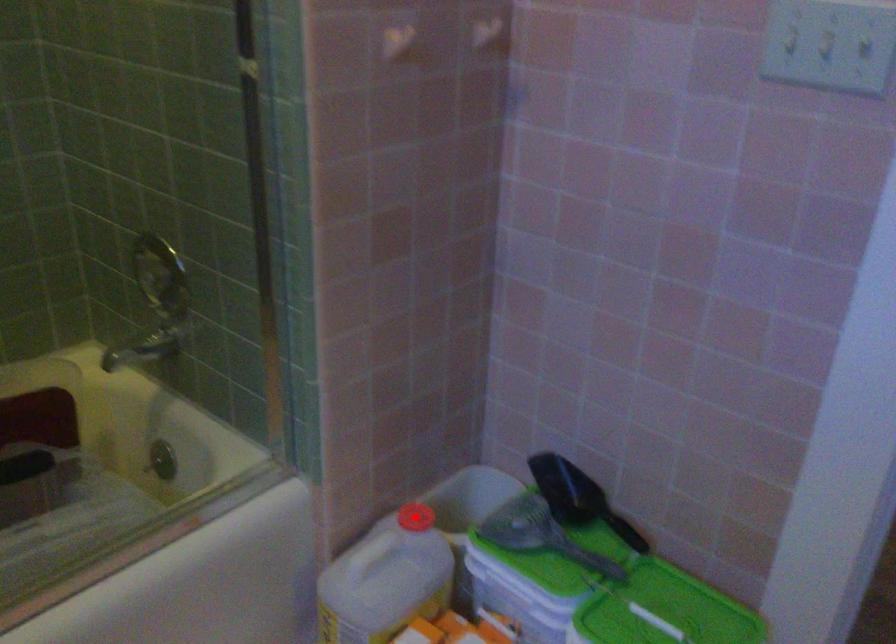
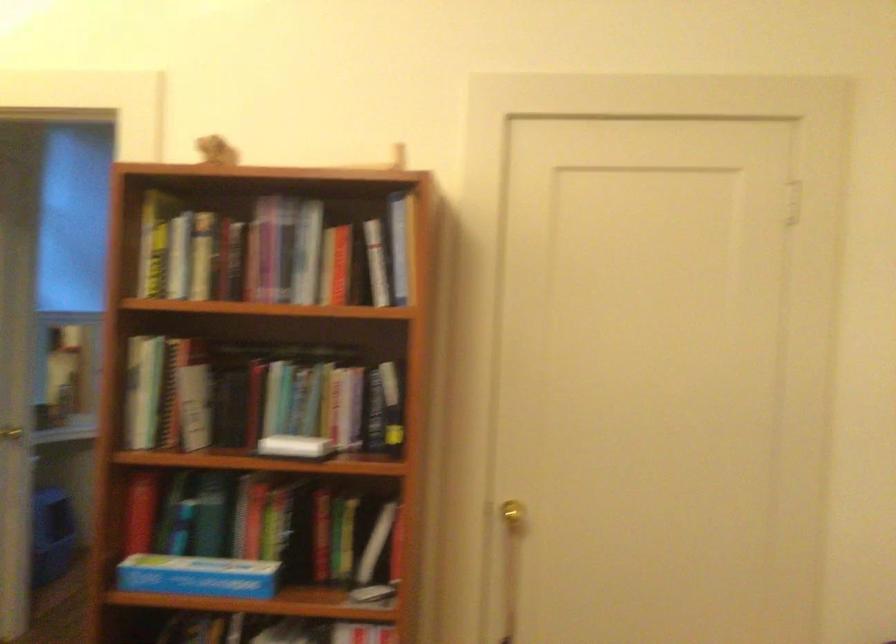
Question: I am providing you with two images of the same scene from different viewpoints. A red point is marked on the first image. Is the red point's position out of view in image 2?

Choices:
 (A) Yes
 (B) No

Answer: (A)